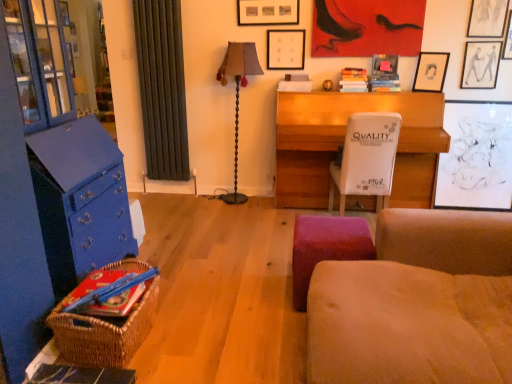
The width and height of the screenshot is (512, 384). In order to click on free space above hardcover book at upper right, positioned as the second book in front-to-back order (from a real-world perspective) in this screenshot , I will do pos(388,65).